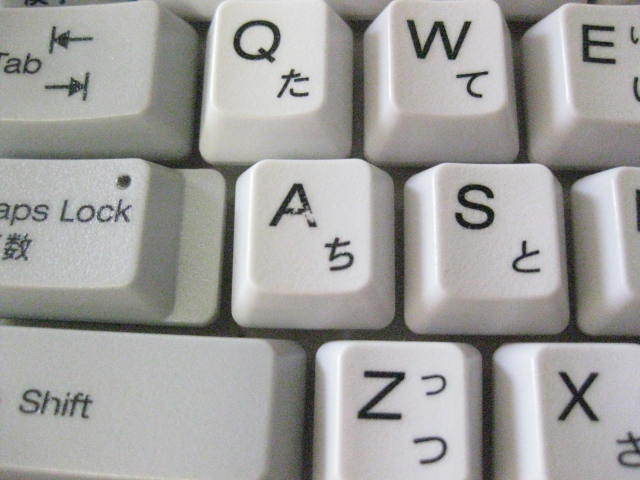
At what (x,y) coordinates should I click in order to perform the action: click on keys. Please return your answer as a coordinate pair (x, y). Looking at the image, I should click on (464, 260).